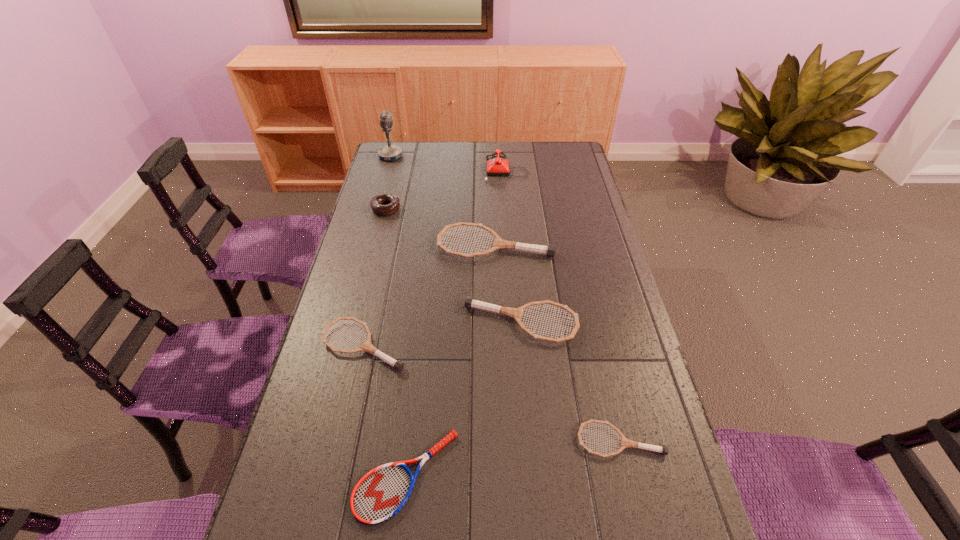
Where is `free space that satisfies the following two spatial constraints: 1. on the back side of the nearest gray tennis racket; 2. on the front-facing side of the tallest object`? The width and height of the screenshot is (960, 540). free space that satisfies the following two spatial constraints: 1. on the back side of the nearest gray tennis racket; 2. on the front-facing side of the tallest object is located at coordinates (554, 157).

Image resolution: width=960 pixels, height=540 pixels. In order to click on vacant space that satisfies the following two spatial constraints: 1. on the dial of the second tallest object; 2. on the front side of the fifth nearest object in this screenshot , I will do `click(513, 245)`.

I want to click on vacant space that satisfies the following two spatial constraints: 1. on the dial of the telephone; 2. on the back side of the second biggest gray tennis racket, so click(x=518, y=323).

Locate an element on the screen. The height and width of the screenshot is (540, 960). vacant region that satisfies the following two spatial constraints: 1. on the front-facing side of the shortest tennis racket; 2. on the right side of the microphone is located at coordinates (302, 475).